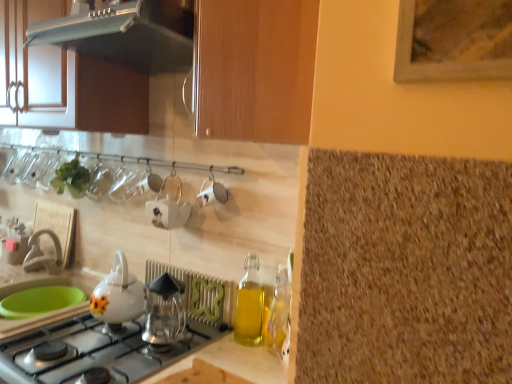
Question: In which direction should I rotate to look at transparent glass coffee maker at center, the 3th kitchen appliance in the top-to-bottom sequence?

Choices:
 (A) left
 (B) right

Answer: (A)

Question: Is transparent glass coffee maker at center, the 3th kitchen appliance in the top-to-bottom sequence, not inside white glossy gas stove at lower left?

Choices:
 (A) no
 (B) yes

Answer: (B)

Question: From a real-world perspective, does transparent glass coffee maker at center, the first kitchen appliance when ordered from bottom to top, sit lower than white glossy gas stove at lower left?

Choices:
 (A) no
 (B) yes

Answer: (A)

Question: Is transparent glass coffee maker at center, the first kitchen appliance when ordered from bottom to top, to the left of white glossy gas stove at lower left from the viewer's perspective?

Choices:
 (A) yes
 (B) no

Answer: (B)

Question: Is transparent glass coffee maker at center, the first kitchen appliance when ordered from bottom to top, thinner than white glossy gas stove at lower left?

Choices:
 (A) no
 (B) yes

Answer: (B)

Question: Is transparent glass coffee maker at center, the first kitchen appliance when ordered from bottom to top, further to the viewer compared to white glossy gas stove at lower left?

Choices:
 (A) yes
 (B) no

Answer: (A)

Question: From a real-world perspective, is transparent glass coffee maker at center, the 3th kitchen appliance in the top-to-bottom sequence, physically above white glossy gas stove at lower left?

Choices:
 (A) yes
 (B) no

Answer: (A)

Question: Is satin silver range hood at upper left, which appears as the 1th kitchen appliance when viewed from the top, thinner than matte white faucet at lower left?

Choices:
 (A) yes
 (B) no

Answer: (B)

Question: From a real-world perspective, is satin silver range hood at upper left, which appears as the 1th kitchen appliance when viewed from the top, physically above matte white faucet at lower left?

Choices:
 (A) yes
 (B) no

Answer: (A)

Question: Is satin silver range hood at upper left, the third kitchen appliance in the bottom-to-top sequence, smaller than matte white faucet at lower left?

Choices:
 (A) no
 (B) yes

Answer: (A)

Question: Is satin silver range hood at upper left, which appears as the 1th kitchen appliance when viewed from the top, looking in the opposite direction of matte white faucet at lower left?

Choices:
 (A) yes
 (B) no

Answer: (B)

Question: Does satin silver range hood at upper left, which appears as the 1th kitchen appliance when viewed from the top, have a greater height compared to matte white faucet at lower left?

Choices:
 (A) yes
 (B) no

Answer: (B)

Question: Is the position of satin silver range hood at upper left, the third kitchen appliance in the bottom-to-top sequence, less distant than that of matte white faucet at lower left?

Choices:
 (A) no
 (B) yes

Answer: (B)

Question: From the image's perspective, is transparent glass coffee maker at center, the 3th kitchen appliance in the top-to-bottom sequence, above white ceramic teapot at center?

Choices:
 (A) yes
 (B) no

Answer: (B)